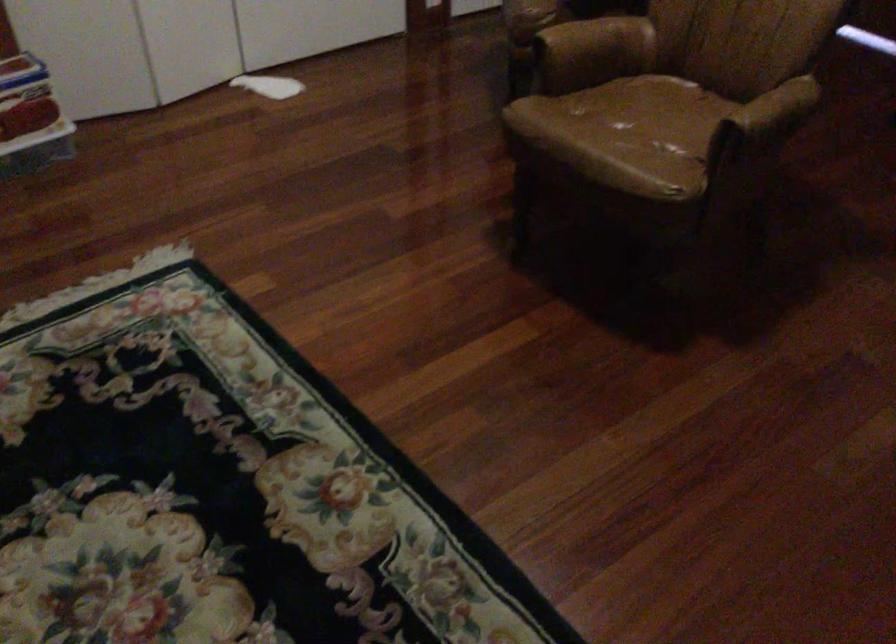
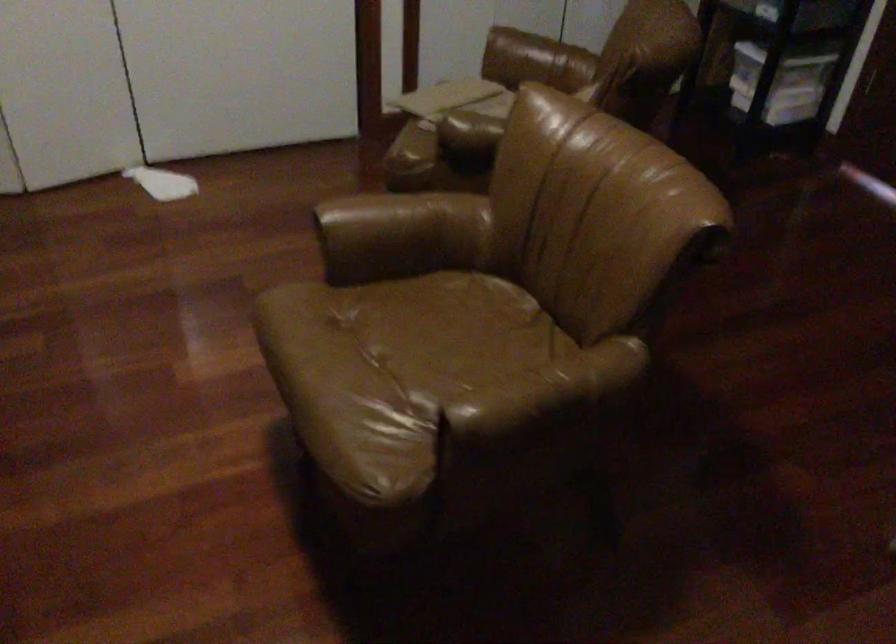
Question: The camera is either moving clockwise (left) or counter-clockwise (right) around the object. The first image is from the beginning of the video and the second image is from the end. Is the camera moving left or right when shooting the video?

Choices:
 (A) Left
 (B) Right

Answer: (B)